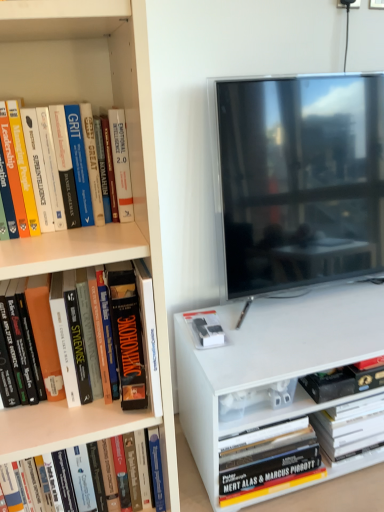
Describe the element at coordinates (344, 380) in the screenshot. I see `black matte book at lower right, which is the second book from back to front` at that location.

The image size is (384, 512). What do you see at coordinates (66, 336) in the screenshot?
I see `orange matte book at left, placed as the fourth book when sorted from right to left` at bounding box center [66, 336].

Where is `hardcover book at lower left, marked as the 2th book in a left-to-right arrangement`? The width and height of the screenshot is (384, 512). hardcover book at lower left, marked as the 2th book in a left-to-right arrangement is located at coordinates (88, 477).

Identify the location of flat-screen tv at right. The image size is (384, 512). (298, 179).

Find the location of `black matte book at lower right, which is the third book in front-to-back order`. black matte book at lower right, which is the third book in front-to-back order is located at coordinates (344, 380).

In the scene shown: Is orange matte book at left, arranged as the fourth book when viewed from the back, looking in the opposite direction of hardcover book at lower left, positioned as the 3th book in right-to-left order?

No, hardcover book at lower left, positioned as the 3th book in right-to-left order, is not at the back of orange matte book at left, arranged as the fourth book when viewed from the back.

Is orange matte book at left, which is the 1th book in left-to-right order, to the left or to the right of hardcover book at lower left, positioned as the 3th book in right-to-left order, in the image?

From the image, it's evident that orange matte book at left, which is the 1th book in left-to-right order, is to the left of hardcover book at lower left, positioned as the 3th book in right-to-left order.

From a real-world perspective, is orange matte book at left, placed as the fourth book when sorted from right to left, physically located above or below hardcover book at lower left, positioned as the 3th book in right-to-left order?

In terms of real-world spatial position, orange matte book at left, placed as the fourth book when sorted from right to left, is above hardcover book at lower left, positioned as the 3th book in right-to-left order.

Can you tell me how much orange matte book at left, which is the 1th book in left-to-right order, and flat-screen tv at right differ in facing direction?

They differ by 0.473 degrees in their facing directions.

Choose the correct answer: Is orange matte book at left, arranged as the fourth book when viewed from the back, inside flat-screen tv at right or outside it?

orange matte book at left, arranged as the fourth book when viewed from the back, is not enclosed by flat-screen tv at right.

Starting from the flat-screen tv at right, which book is the 2nd one in front? Please provide its 2D coordinates.

[(66, 336)]

Is orange matte book at left, which is the 1th book in left-to-right order, at the right side of flat-screen tv at right?

In fact, orange matte book at left, which is the 1th book in left-to-right order, is to the left of flat-screen tv at right.

Does flat-screen tv at right have a smaller size compared to hardcover book at lower left, positioned as the 3th book in right-to-left order?

Actually, flat-screen tv at right might be larger than hardcover book at lower left, positioned as the 3th book in right-to-left order.

Which of these two, flat-screen tv at right or hardcover book at lower left, marked as the 2th book in a left-to-right arrangement, is wider?

flat-screen tv at right.

Does flat-screen tv at right turn towards hardcover book at lower left, positioned as the 3th book in right-to-left order?

No, flat-screen tv at right does not turn towards hardcover book at lower left, positioned as the 3th book in right-to-left order.

Can you confirm if flat-screen tv at right is positioned to the right of hardcover book at lower left, which appears as the 2th book when viewed from the front?

Correct, you'll find flat-screen tv at right to the right of hardcover book at lower left, which appears as the 2th book when viewed from the front.

Is flat-screen tv at right touching hardcover book at lower right, which is counted as the first book, starting from the back?

flat-screen tv at right and hardcover book at lower right, which is counted as the first book, starting from the back, are not in contact.

Considering the points (250, 114) and (367, 406), which point is in front, point (250, 114) or point (367, 406)?

The point (250, 114) is closer.

Considering the relative positions of flat-screen tv at right and hardcover book at lower right, the first book positioned from the right, in the image provided, is flat-screen tv at right behind hardcover book at lower right, the first book positioned from the right,?

No, flat-screen tv at right is in front of hardcover book at lower right, the first book positioned from the right.

Can you confirm if flat-screen tv at right is wider than hardcover book at lower right, the first book positioned from the right?

Incorrect, the width of flat-screen tv at right does not surpass that of hardcover book at lower right, the first book positioned from the right.

Is hardcover book at lower right, the first book positioned from the right, touching orange matte book at left, arranged as the fourth book when viewed from the back?

No.

From a real-world perspective, which object stands above the other?

orange matte book at left, placed as the fourth book when sorted from right to left.

Is hardcover book at lower right, which is counted as the first book, starting from the back, facing towards orange matte book at left, which ranks as the 1th book in front-to-back order?

No, hardcover book at lower right, which is counted as the first book, starting from the back, is not oriented towards orange matte book at left, which ranks as the 1th book in front-to-back order.

From a real-world perspective, relative to hardcover book at lower left, marked as the 2th book in a left-to-right arrangement, is black matte book at lower right, which is the third book in left-to-right order, vertically above or below?

black matte book at lower right, which is the third book in left-to-right order, is situated lower than hardcover book at lower left, marked as the 2th book in a left-to-right arrangement, in the real world.

Is black matte book at lower right, which ranks as the second book in right-to-left order, positioned beyond the bounds of hardcover book at lower left, positioned as the 3th book in right-to-left order?

Absolutely, black matte book at lower right, which ranks as the second book in right-to-left order, is external to hardcover book at lower left, positioned as the 3th book in right-to-left order.

From the image's perspective, is black matte book at lower right, which is the second book from back to front, beneath hardcover book at lower left, marked as the 2th book in a left-to-right arrangement?

Actually, black matte book at lower right, which is the second book from back to front, appears above hardcover book at lower left, marked as the 2th book in a left-to-right arrangement, in the image.

Locate an element on the screen. This screenshot has height=512, width=384. book on the right of black matte book at lower right, which is the third book in front-to-back order is located at coordinates (350, 426).

Is black matte book at lower right, which is the second book from back to front, shorter than hardcover book at lower right, arranged as the 4th book when viewed from the front?

Yes, black matte book at lower right, which is the second book from back to front, is shorter than hardcover book at lower right, arranged as the 4th book when viewed from the front.

Considering the relative sizes of black matte book at lower right, which is the third book in front-to-back order, and hardcover book at lower right, which is counted as the first book, starting from the back, in the image provided, is black matte book at lower right, which is the third book in front-to-back order, thinner than hardcover book at lower right, which is counted as the first book, starting from the back,?

Yes, black matte book at lower right, which is the third book in front-to-back order, is thinner than hardcover book at lower right, which is counted as the first book, starting from the back.

Looking at this image, relative to hardcover book at lower right, the first book positioned from the right, is black matte book at lower right, which ranks as the second book in right-to-left order, in front or behind?

Clearly, black matte book at lower right, which ranks as the second book in right-to-left order, is in front of hardcover book at lower right, the first book positioned from the right.

I want to click on book on the left of hardcover book at lower left, marked as the 2th book in a left-to-right arrangement, so tap(66, 336).

This screenshot has height=512, width=384. In order to click on television on the right of orange matte book at left, which is the 1th book in left-to-right order in this screenshot , I will do `click(298, 179)`.

From the image, which object appears to be nearer to black matte book at lower right, which ranks as the second book in right-to-left order, hardcover book at lower right, which is counted as the fourth book, starting from the left, or orange matte book at left, which ranks as the 1th book in front-to-back order?

The object closer to black matte book at lower right, which ranks as the second book in right-to-left order, is hardcover book at lower right, which is counted as the fourth book, starting from the left.

When comparing their distances from flat-screen tv at right, does black matte book at lower right, which is the second book from back to front, or hardcover book at lower left, which appears as the 2th book when viewed from the front, seem closer?

black matte book at lower right, which is the second book from back to front, is closer to flat-screen tv at right.

Which object lies further to the anchor point hardcover book at lower right, which is counted as the first book, starting from the back, orange matte book at left, which is the 1th book in left-to-right order, or hardcover book at lower left, marked as the 2th book in a left-to-right arrangement?

orange matte book at left, which is the 1th book in left-to-right order.

Estimate the real-world distances between objects in this image. Which object is further from orange matte book at left, placed as the fourth book when sorted from right to left, hardcover book at lower left, positioned as the third book in back-to-front order, or flat-screen tv at right?

flat-screen tv at right lies further to orange matte book at left, placed as the fourth book when sorted from right to left, than the other object.

From the image, which object appears to be nearer to flat-screen tv at right, black matte book at lower right, which is the third book in left-to-right order, or orange matte book at left, placed as the fourth book when sorted from right to left?

Based on the image, black matte book at lower right, which is the third book in left-to-right order, appears to be nearer to flat-screen tv at right.

Based on their spatial positions, is hardcover book at lower right, which is counted as the first book, starting from the back, or black matte book at lower right, which is the second book from back to front, further from hardcover book at lower left, positioned as the third book in back-to-front order?

hardcover book at lower right, which is counted as the first book, starting from the back, is positioned further to the anchor hardcover book at lower left, positioned as the third book in back-to-front order.

When comparing their distances from orange matte book at left, arranged as the fourth book when viewed from the back, does black matte book at lower right, which is the third book in front-to-back order, or hardcover book at lower right, which is counted as the first book, starting from the back, seem closer?

black matte book at lower right, which is the third book in front-to-back order, is closer to orange matte book at left, arranged as the fourth book when viewed from the back.

Consider the image. Based on their spatial positions, is flat-screen tv at right or black matte book at lower right, which ranks as the second book in right-to-left order, closer to hardcover book at lower right, which is counted as the first book, starting from the back?

black matte book at lower right, which ranks as the second book in right-to-left order, lies closer to hardcover book at lower right, which is counted as the first book, starting from the back, than the other object.

In order to click on television between hardcover book at lower left, marked as the 2th book in a left-to-right arrangement, and black matte book at lower right, which is the third book in front-to-back order in this screenshot , I will do `click(298, 179)`.

The height and width of the screenshot is (512, 384). In order to click on television situated between orange matte book at left, which ranks as the 1th book in front-to-back order, and black matte book at lower right, which is the third book in front-to-back order, from left to right in this screenshot , I will do `click(298, 179)`.

Where is `television between orange matte book at left, placed as the fourth book when sorted from right to left, and hardcover book at lower right, which is counted as the first book, starting from the back`? The height and width of the screenshot is (512, 384). television between orange matte book at left, placed as the fourth book when sorted from right to left, and hardcover book at lower right, which is counted as the first book, starting from the back is located at coordinates (298, 179).

I want to click on television situated between hardcover book at lower left, marked as the 2th book in a left-to-right arrangement, and hardcover book at lower right, arranged as the 4th book when viewed from the front, from left to right, so click(x=298, y=179).